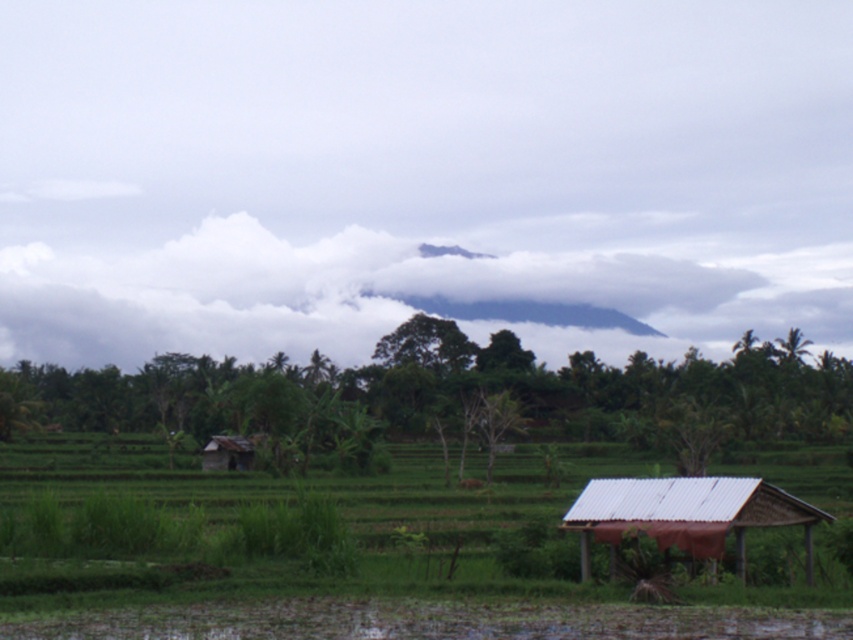
Question: Which point is closer to the camera?

Choices:
 (A) (721, 310)
 (B) (701, 500)
 (C) (218, 451)

Answer: (B)

Question: Which object is positioned farthest from the metal/thatched hut at lower right?

Choices:
 (A) white fluffy cloud at upper center
 (B) brown corrugated roof hut at lower left

Answer: (A)

Question: Which point is farther from the camera taking this photo?

Choices:
 (A) (672, 524)
 (B) (247, 451)

Answer: (B)

Question: Where is metal/thatched hut at lower right located in relation to brown corrugated roof hut at lower left in the image?

Choices:
 (A) above
 (B) below

Answer: (A)

Question: Does white fluffy cloud at upper center appear over brown corrugated roof hut at lower left?

Choices:
 (A) yes
 (B) no

Answer: (A)

Question: Is white fluffy cloud at upper center closer to the viewer compared to brown corrugated roof hut at lower left?

Choices:
 (A) no
 (B) yes

Answer: (A)